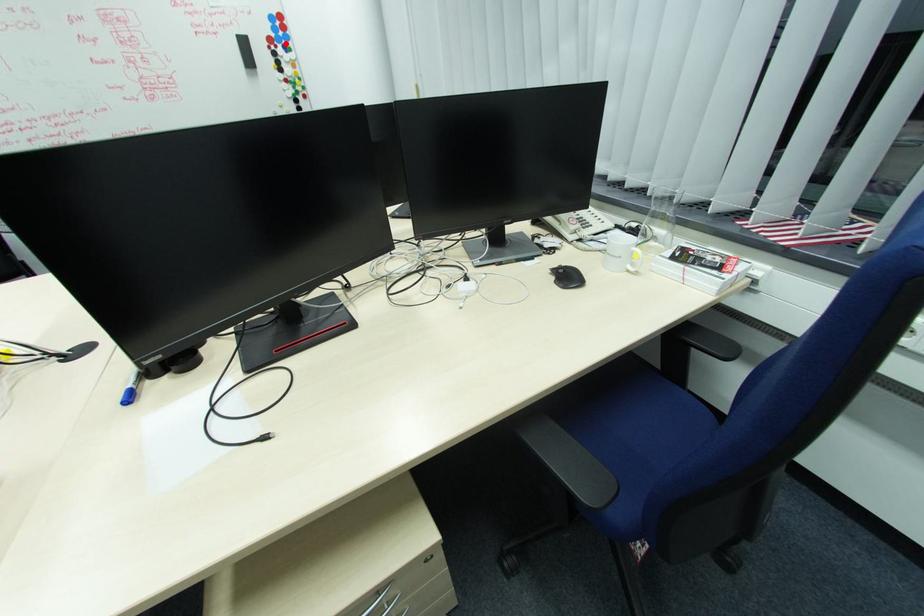
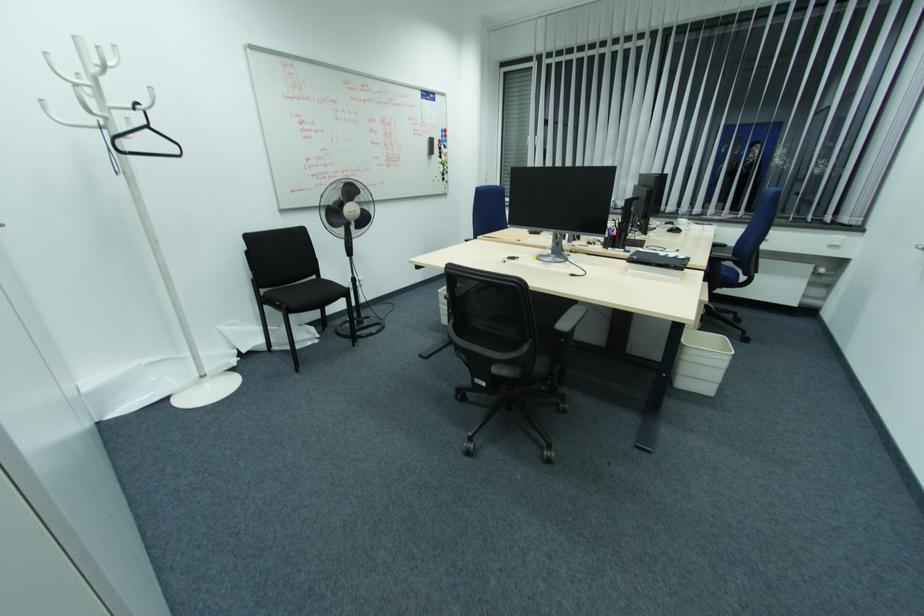
Locate, in the second image, the point that corresponds to the highlighted location in the first image.

(445, 144)